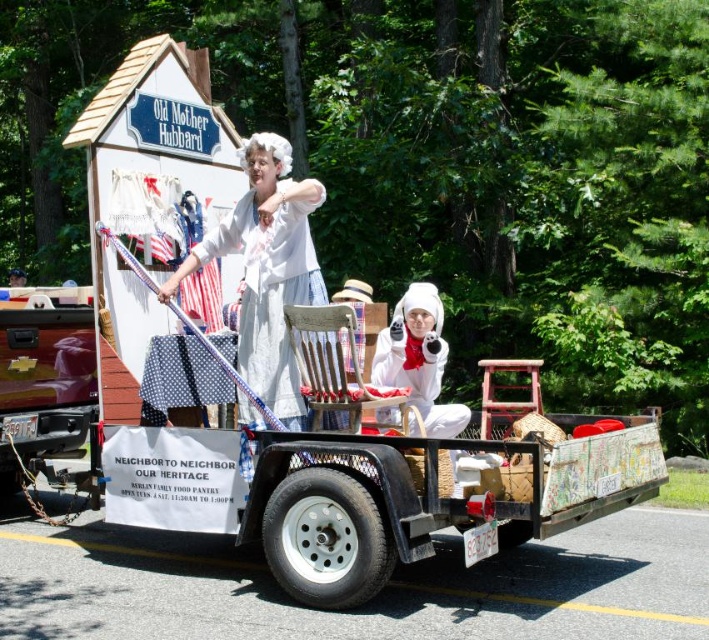
Consider the image. Can you confirm if white cotton dress at center is positioned to the right of white fluffy costume at center?

In fact, white cotton dress at center is to the left of white fluffy costume at center.

Can you confirm if white cotton dress at center is wider than white fluffy costume at center?

Yes.

What are the coordinates of `white cotton dress at center` in the screenshot? It's located at (267, 269).

Locate an element on the screen. This screenshot has height=640, width=709. white cotton dress at center is located at coordinates (267, 269).